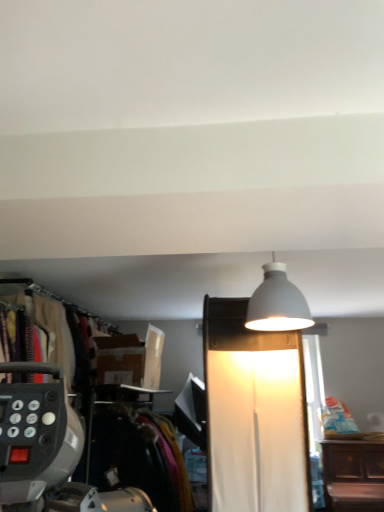
Question: Is white matte lamp at upper center, the second lamp when ordered from top to bottom, to the right of white matte lampshade at upper center, marked as the second lamp in a bottom-to-top arrangement, from the viewer's perspective?

Choices:
 (A) yes
 (B) no

Answer: (B)

Question: Does white matte lamp at upper center, the second lamp when ordered from top to bottom, have a larger size compared to white matte lampshade at upper center, positioned as the first lamp in top-to-bottom order?

Choices:
 (A) no
 (B) yes

Answer: (B)

Question: From the image's perspective, is white matte lamp at upper center, the second lamp when ordered from top to bottom, under white matte lampshade at upper center, positioned as the first lamp in top-to-bottom order?

Choices:
 (A) no
 (B) yes

Answer: (B)

Question: From a real-world perspective, is white matte lamp at upper center, the 1th lamp from the bottom, beneath white matte lampshade at upper center, marked as the second lamp in a bottom-to-top arrangement?

Choices:
 (A) yes
 (B) no

Answer: (A)

Question: From the image's perspective, is white matte lamp at upper center, the 1th lamp from the bottom, above white matte lampshade at upper center, marked as the second lamp in a bottom-to-top arrangement?

Choices:
 (A) no
 (B) yes

Answer: (A)

Question: Is velvet-like fabric at left bigger or smaller than white matte lampshade at upper center, positioned as the first lamp in top-to-bottom order?

Choices:
 (A) big
 (B) small

Answer: (A)

Question: Based on their positions, is velvet-like fabric at left located to the left or right of white matte lampshade at upper center, marked as the second lamp in a bottom-to-top arrangement?

Choices:
 (A) right
 (B) left

Answer: (B)

Question: Does point (170, 485) appear closer or farther from the camera than point (279, 282)?

Choices:
 (A) farther
 (B) closer

Answer: (A)

Question: From a real-world perspective, is velvet-like fabric at left above or below white matte lampshade at upper center, marked as the second lamp in a bottom-to-top arrangement?

Choices:
 (A) below
 (B) above

Answer: (A)

Question: From their relative heights in the image, would you say black fabric closet at left is taller or shorter than white matte lamp at upper center, the 1th lamp from the bottom?

Choices:
 (A) short
 (B) tall

Answer: (A)

Question: From a real-world perspective, relative to white matte lamp at upper center, the 1th lamp from the bottom, is black fabric closet at left vertically above or below?

Choices:
 (A) below
 (B) above

Answer: (B)

Question: Visually, is black fabric closet at left positioned to the left or to the right of white matte lamp at upper center, the 1th lamp from the bottom?

Choices:
 (A) right
 (B) left

Answer: (B)

Question: From the image's perspective, is black fabric closet at left located above or below white matte lamp at upper center, the 1th lamp from the bottom?

Choices:
 (A) below
 (B) above

Answer: (B)

Question: From the image's perspective, is white matte lampshade at upper center, positioned as the first lamp in top-to-bottom order, located above or below white matte lamp at upper center, the 1th lamp from the bottom?

Choices:
 (A) above
 (B) below

Answer: (A)

Question: Choose the correct answer: Is white matte lampshade at upper center, positioned as the first lamp in top-to-bottom order, inside white matte lamp at upper center, the 1th lamp from the bottom, or outside it?

Choices:
 (A) outside
 (B) inside

Answer: (A)